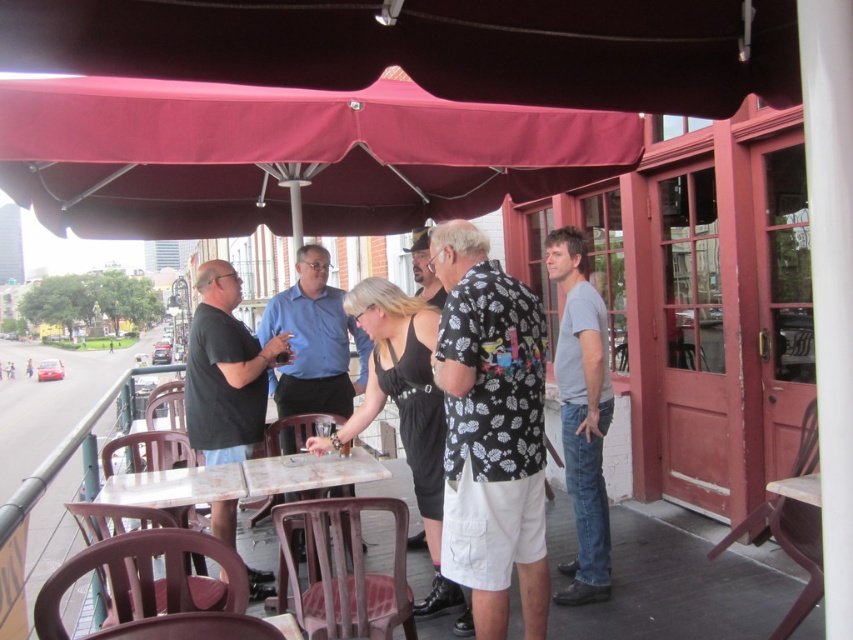
Question: Is black floral shirt at center thinner than black matte dress at center?

Choices:
 (A) yes
 (B) no

Answer: (A)

Question: Which point is farther to the camera?

Choices:
 (A) (585, 164)
 (B) (329, 358)
 (C) (341, 444)
 (D) (258, 496)

Answer: (B)

Question: Among these objects, which one is nearest to the camera?

Choices:
 (A) gray cotton t-shirt at right
 (B) black matte shirt at center

Answer: (B)

Question: Is black floral shirt at center to the left of white marble table at center from the viewer's perspective?

Choices:
 (A) no
 (B) yes

Answer: (A)

Question: Which is farther from the black matte shirt at center?

Choices:
 (A) matte blue shirt at center
 (B) white marble table at center
 (C) black matte dress at center
 (D) black floral shirt at center

Answer: (D)

Question: Does maroon fabric canopy at upper center have a lesser width compared to black matte dress at center?

Choices:
 (A) no
 (B) yes

Answer: (A)